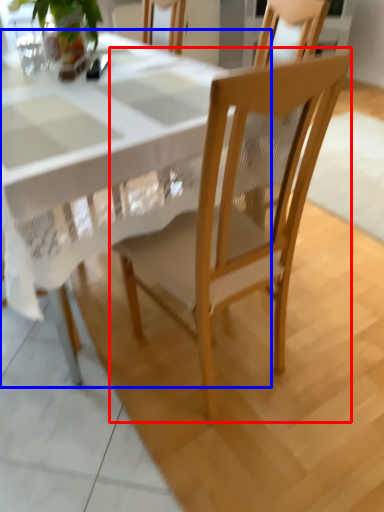
Question: Which object appears farthest to the camera in this image, chair (highlighted by a red box) or round table (highlighted by a blue box)?

Choices:
 (A) chair
 (B) round table

Answer: (B)